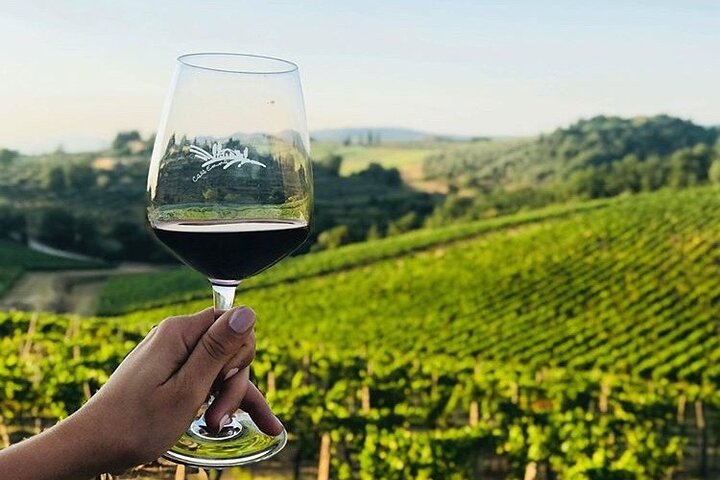
Find the location of a particular element. This screenshot has height=480, width=720. glass is located at coordinates (273, 156).